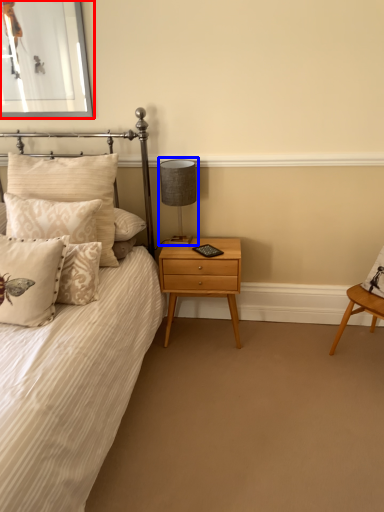
Question: Which of the following is the farthest to the observer, picture frame (highlighted by a red box) or table lamp (highlighted by a blue box)?

Choices:
 (A) picture frame
 (B) table lamp

Answer: (B)